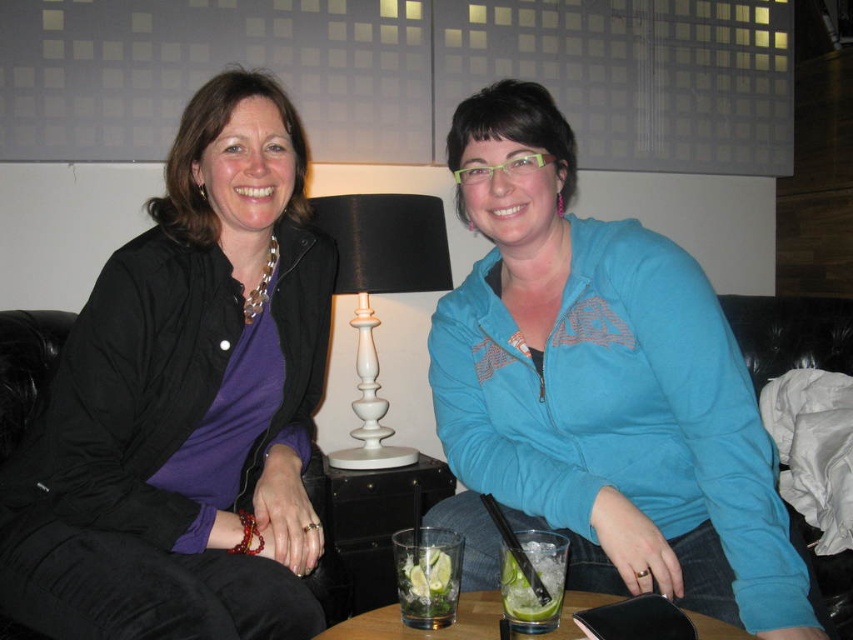
Locate an element on the screen. This screenshot has width=853, height=640. matte black jacket at center is located at coordinates (184, 403).

Which is behind, point (175, 586) or point (399, 620)?

The point (175, 586) is behind.

Locate an element on the screen. matte black jacket at center is located at coordinates (184, 403).

Based on the photo, is blue fleece jacket at center closer to camera compared to white glossy lamp at center?

Yes, it is.

Is blue fleece jacket at center shorter than white glossy lamp at center?

No.

I want to click on blue fleece jacket at center, so click(x=601, y=392).

Describe the element at coordinates (601, 392) in the screenshot. The image size is (853, 640). I see `blue fleece jacket at center` at that location.

Is blue fleece jacket at center further to camera compared to translucent glass table at center?

Yes, it is behind translucent glass table at center.

Which is in front, point (495, 570) or point (694, 618)?

Point (694, 618) is more forward.

Find the location of a particular element. This screenshot has width=853, height=640. blue fleece jacket at center is located at coordinates (601, 392).